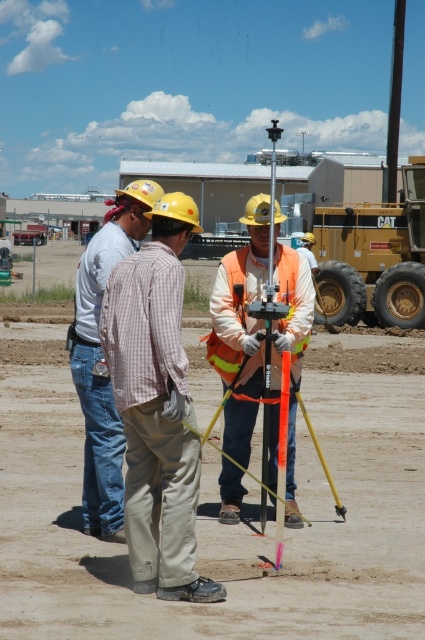
Can you confirm if reflective orange vest at center is positioned above metallic silver pole at center?

No.

Describe the element at coordinates (240, 326) in the screenshot. I see `reflective orange vest at center` at that location.

Is point (271, 436) closer to viewer compared to point (274, 244)?

That is False.

This screenshot has height=640, width=425. I want to click on reflective orange vest at center, so click(x=240, y=326).

Which is above, denim jeans at left or hi-visibility orange safety vest at center?

Positioned higher is hi-visibility orange safety vest at center.

Looking at this image, who is lower down, denim jeans at left or hi-visibility orange safety vest at center?

Positioned lower is denim jeans at left.

At what (x,y) coordinates should I click in order to perform the action: click on denim jeans at left. Please return your answer as a coordinate pair (x, y). The width and height of the screenshot is (425, 640). Looking at the image, I should click on (102, 358).

Measure the distance between point (272,461) and camera.

Point (272,461) is 26.18 feet from camera.

Who is more distant from viewer, (251, 378) or (150, 198)?

The point (251, 378) is behind.

This screenshot has height=640, width=425. What are the coordinates of `reflective orange vest at center` in the screenshot? It's located at (240, 326).